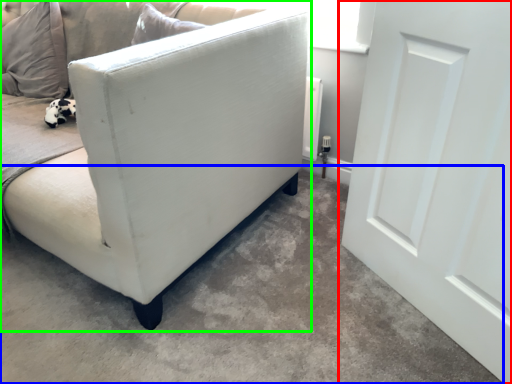
Question: Considering the real-world distances, which object is farthest from door (highlighted by a red box)? concrete (highlighted by a blue box) or studio couch (highlighted by a green box)?

Choices:
 (A) concrete
 (B) studio couch

Answer: (B)